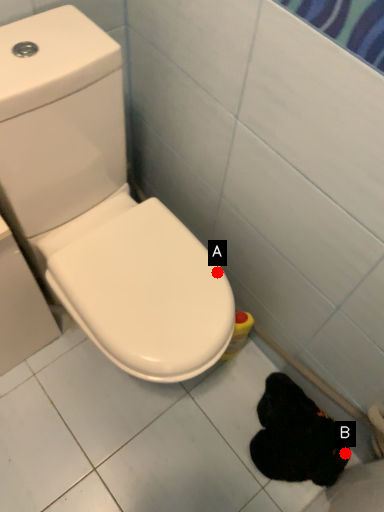
Question: Two points are circled on the image, labeled by A and B beside each circle. Among these points, which one is nearest to the camera?

Choices:
 (A) A is closer
 (B) B is closer

Answer: (A)